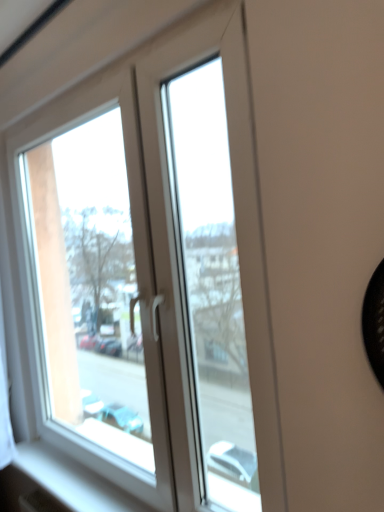
Question: From a real-world perspective, is white smooth window sill at lower left positioned over white plastic window at upper left based on gravity?

Choices:
 (A) no
 (B) yes

Answer: (A)

Question: Is white smooth window sill at lower left far from white plastic window at upper left?

Choices:
 (A) yes
 (B) no

Answer: (B)

Question: From a real-world perspective, is white smooth window sill at lower left positioned under white plastic window at upper left based on gravity?

Choices:
 (A) yes
 (B) no

Answer: (A)

Question: Does white smooth window sill at lower left lie behind white plastic window at upper left?

Choices:
 (A) yes
 (B) no

Answer: (A)

Question: Is white smooth window sill at lower left to the left of white plastic window at upper left from the viewer's perspective?

Choices:
 (A) no
 (B) yes

Answer: (B)

Question: Is white smooth window sill at lower left taller than white plastic window at upper left?

Choices:
 (A) no
 (B) yes

Answer: (A)

Question: Considering the relative positions of white plastic window at upper left and white smooth window sill at lower left in the image provided, is white plastic window at upper left to the right of white smooth window sill at lower left from the viewer's perspective?

Choices:
 (A) no
 (B) yes

Answer: (B)

Question: From a real-world perspective, is white plastic window at upper left on white smooth window sill at lower left?

Choices:
 (A) yes
 (B) no

Answer: (A)

Question: Is white plastic window at upper left thinner than white smooth window sill at lower left?

Choices:
 (A) yes
 (B) no

Answer: (A)

Question: Does white plastic window at upper left have a larger size compared to white smooth window sill at lower left?

Choices:
 (A) yes
 (B) no

Answer: (A)

Question: From the image's perspective, is white plastic window at upper left on top of white smooth window sill at lower left?

Choices:
 (A) no
 (B) yes

Answer: (B)

Question: From a real-world perspective, does white plastic window at upper left sit lower than white smooth window sill at lower left?

Choices:
 (A) yes
 (B) no

Answer: (B)

Question: From a real-world perspective, is white plastic window at upper left above or below white smooth window sill at lower left?

Choices:
 (A) below
 (B) above

Answer: (B)